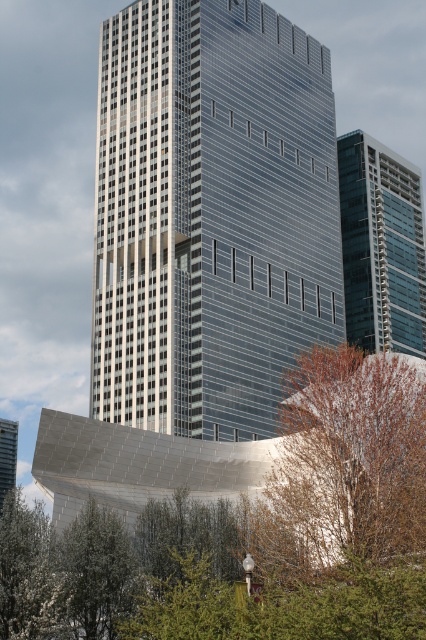
Is glassy steel skyscraper at center thinner than brown leafy tree at center-right?

No, glassy steel skyscraper at center is not thinner than brown leafy tree at center-right.

Which is below, glassy steel skyscraper at center or brown leafy tree at center-right?

brown leafy tree at center-right is below.

Measure the distance between point (212, 102) and camera.

97.35 meters

This screenshot has height=640, width=426. In order to click on glassy steel skyscraper at center in this screenshot , I will do `click(210, 216)`.

The image size is (426, 640). What do you see at coordinates (345, 467) in the screenshot?
I see `brown leafy tree at center-right` at bounding box center [345, 467].

Who is lower down, brown leafy tree at center-right or green glass building at right?

brown leafy tree at center-right is lower down.

Is point (383, 364) closer to camera compared to point (409, 221)?

Yes, it is.

Image resolution: width=426 pixels, height=640 pixels. Identify the location of brown leafy tree at center-right. (345, 467).

Is point (118, 246) less distant than point (348, 228)?

Yes, point (118, 246) is closer to viewer.

Who is lower down, glassy steel skyscraper at center or green glass building at right?

green glass building at right is lower down.

Is point (308, 317) positioned in front of point (402, 284)?

Yes, point (308, 317) is closer to viewer.

Identify the location of glassy steel skyscraper at center. The width and height of the screenshot is (426, 640). (210, 216).